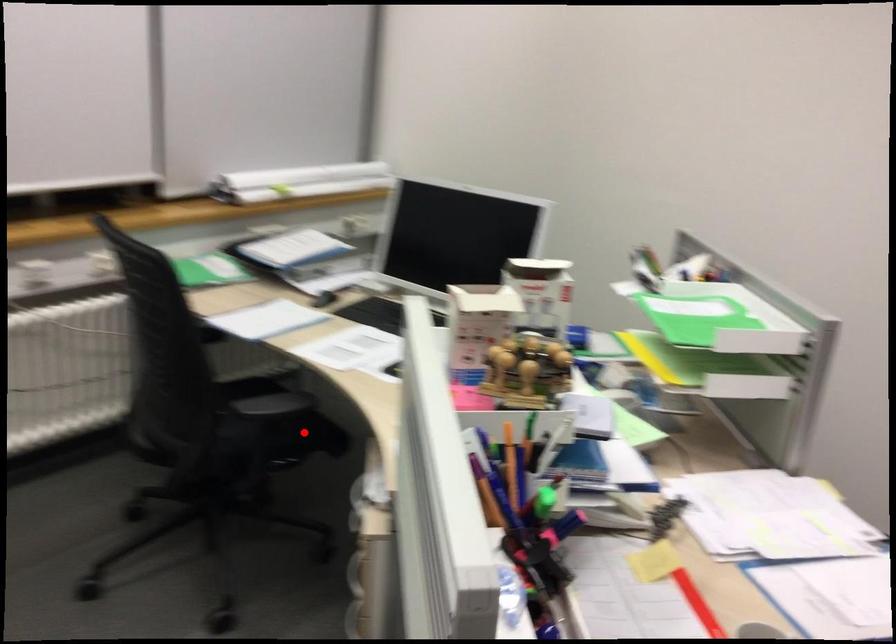
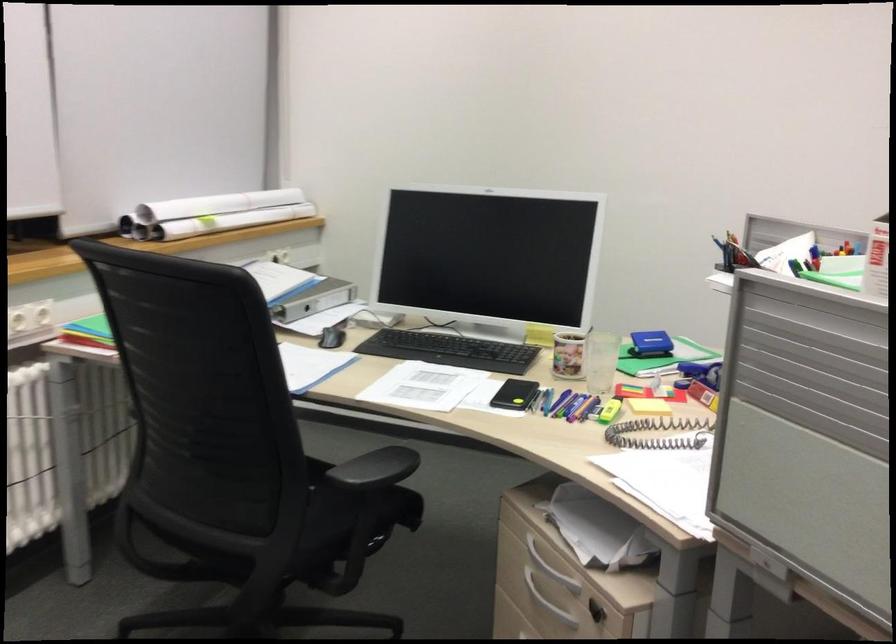
Find the pixel in the second image that matches the highlighted location in the first image.

(380, 498)